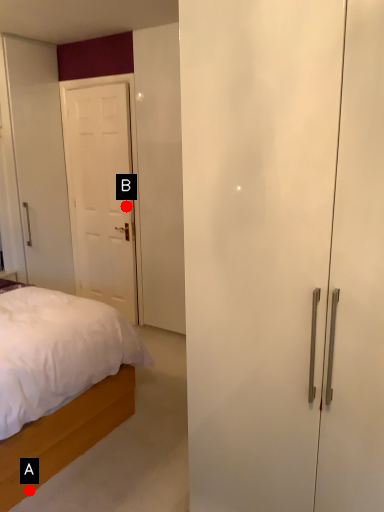
Question: Two points are circled on the image, labeled by A and B beside each circle. Which point is farther to the camera?

Choices:
 (A) A is further
 (B) B is further

Answer: (B)